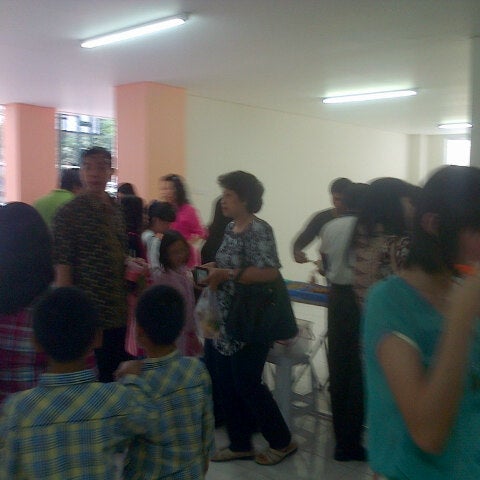
At what (x,y) coordinates should I click in order to perform the action: click on bulb. Please return your answer as a coordinate pair (x, y). This screenshot has height=480, width=480. Looking at the image, I should click on (376, 94).